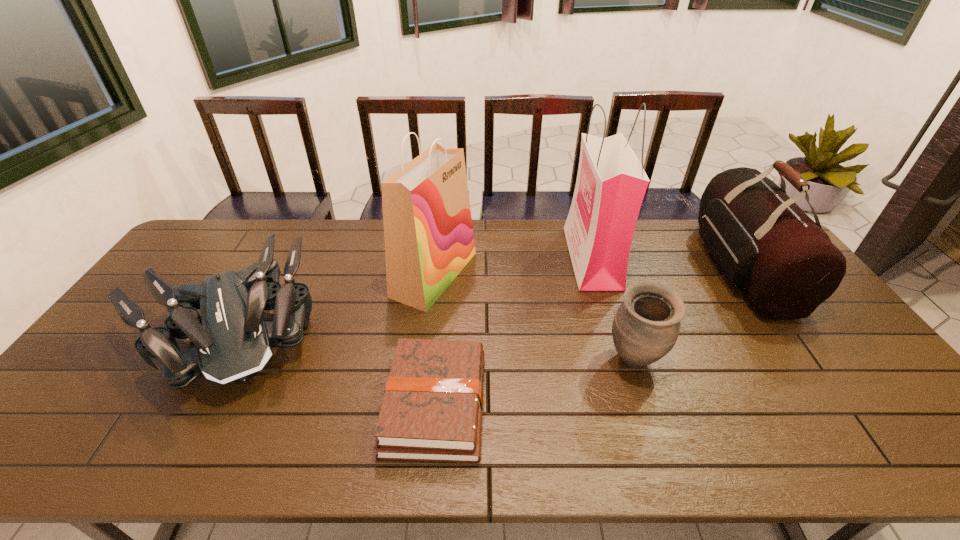
I want to click on the right shopping bag, so click(x=611, y=183).

What are the coordinates of `the left shopping bag` in the screenshot? It's located at (428, 233).

Where is `duffel bag`? The width and height of the screenshot is (960, 540). duffel bag is located at coordinates (785, 265).

Find the location of a particular element. the rightmost object is located at coordinates (785, 265).

The height and width of the screenshot is (540, 960). Find the location of `the fourth tallest object`. the fourth tallest object is located at coordinates (646, 326).

Where is `the second shortest object`? Image resolution: width=960 pixels, height=540 pixels. the second shortest object is located at coordinates (233, 341).

The image size is (960, 540). I want to click on the leftmost object, so click(233, 341).

The image size is (960, 540). I want to click on hardback book, so click(432, 408).

At what (x,y) coordinates should I click in order to perform the action: click on vacant space situated 0.280m on the front-facing side of the right shopping bag. Please return your answer as a coordinate pair (x, y). Image resolution: width=960 pixels, height=540 pixels. Looking at the image, I should click on (487, 258).

The height and width of the screenshot is (540, 960). What are the coordinates of `vacant space positioned 0.350m on the front-facing side of the right shopping bag` in the screenshot? It's located at (467, 258).